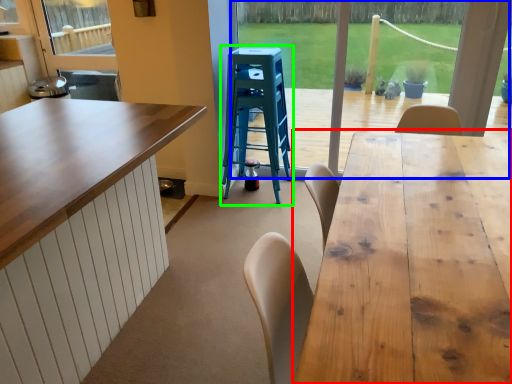
Question: Which is farther away from table (highlighted by a red box)? window frame (highlighted by a blue box) or step stool (highlighted by a green box)?

Choices:
 (A) window frame
 (B) step stool

Answer: (A)